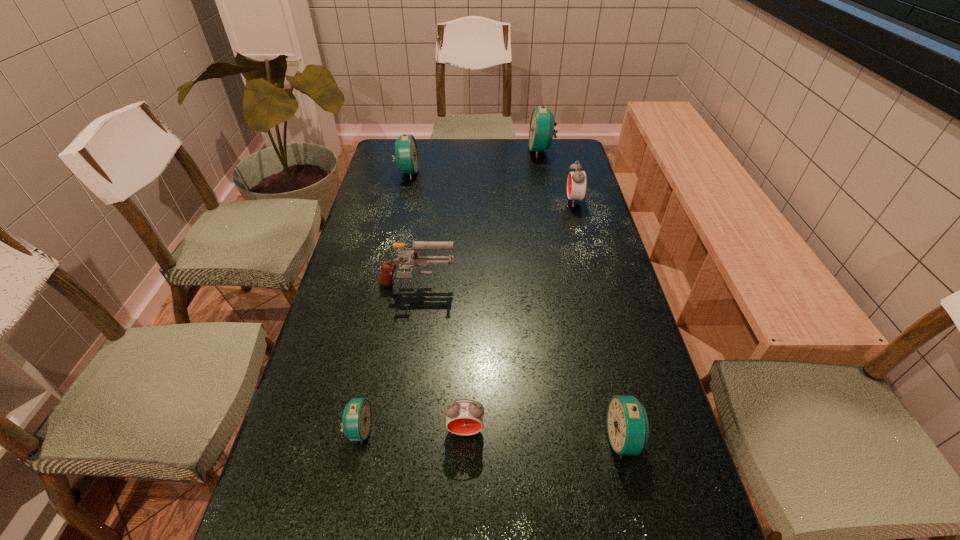
Find the location of a particular element. Image resolution: width=960 pixels, height=540 pixels. the tallest object is located at coordinates (541, 131).

You are a GUI agent. You are given a task and a screenshot of the screen. Output one action in this format:
    pyautogui.click(x=<x>, y=<y>)
    Task: Click on the farthest blue alarm clock
    
    Given the screenshot: What is the action you would take?
    pyautogui.click(x=541, y=131)

Where is `the third farthest object`? The height and width of the screenshot is (540, 960). the third farthest object is located at coordinates (577, 181).

Locate an element on the screen. This screenshot has width=960, height=540. the farther red alarm clock is located at coordinates (577, 181).

You are a GUI agent. You are given a task and a screenshot of the screen. Output one action in this format:
    pyautogui.click(x=<x>, y=<y>)
    Task: Click on the third smallest blue alarm clock
    
    Given the screenshot: What is the action you would take?
    pyautogui.click(x=406, y=155)

This screenshot has height=540, width=960. I want to click on the sixth nearest object, so click(406, 155).

Where is `the fourth farthest object`? The image size is (960, 540). the fourth farthest object is located at coordinates (419, 259).

Where is `the second smallest blue alarm clock`? The height and width of the screenshot is (540, 960). the second smallest blue alarm clock is located at coordinates (x=627, y=422).

Image resolution: width=960 pixels, height=540 pixels. What are the coordinates of `the smaller red alarm clock` in the screenshot? It's located at (464, 416).

The image size is (960, 540). What are the coordinates of `the left red alarm clock` in the screenshot? It's located at (464, 416).